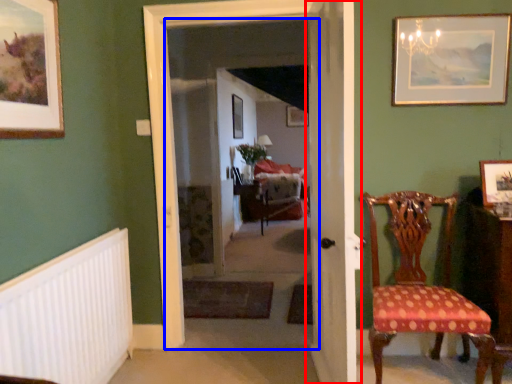
Question: Among these objects, which one is nearest to the camera, door (highlighted by a red box) or corridor (highlighted by a blue box)?

Choices:
 (A) door
 (B) corridor

Answer: (A)